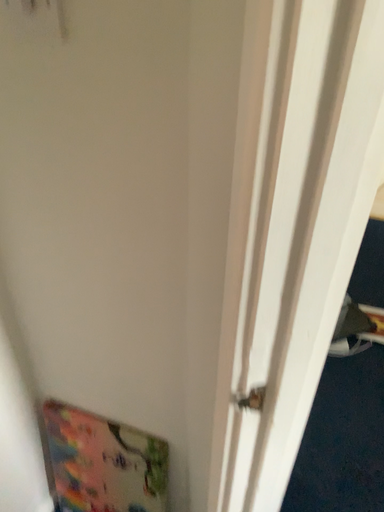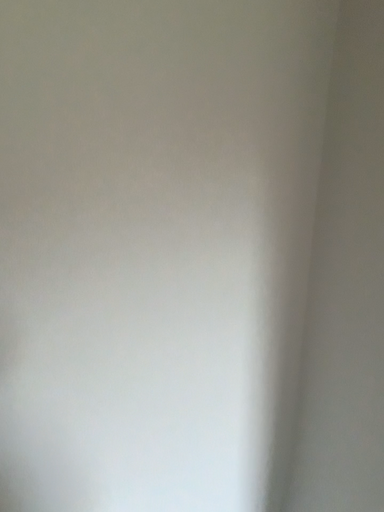
Question: Which way did the camera rotate in the video?

Choices:
 (A) rotated downward
 (B) rotated upward

Answer: (B)